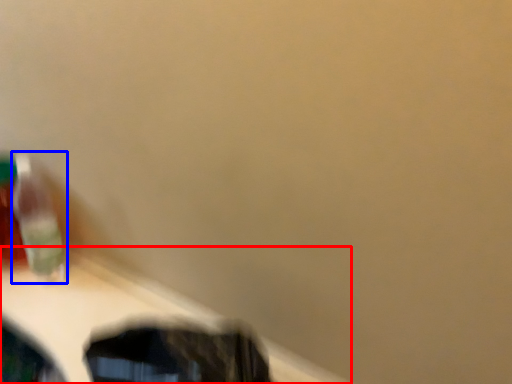
Question: Which object appears farthest to the camera in this image, table (highlighted by a red box) or toothbrush (highlighted by a blue box)?

Choices:
 (A) table
 (B) toothbrush

Answer: (B)